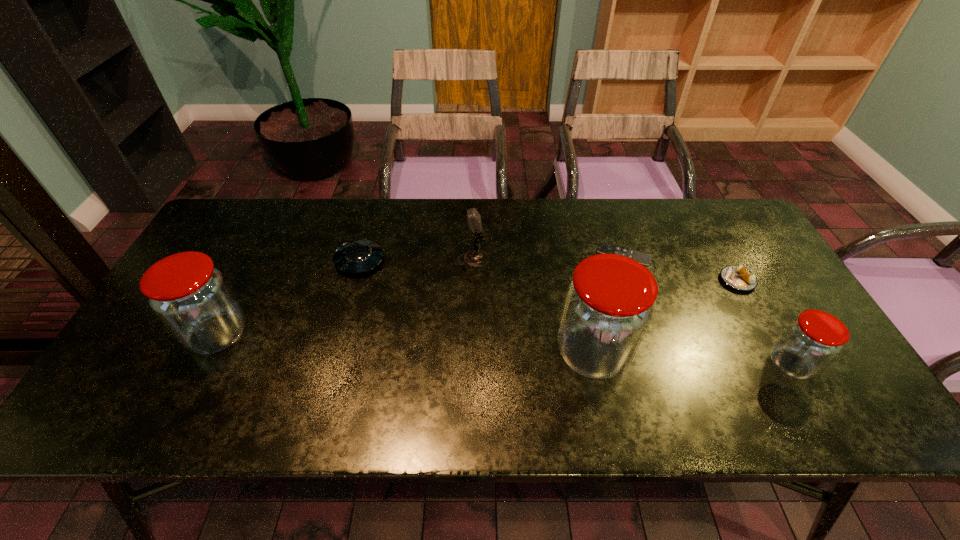
The height and width of the screenshot is (540, 960). Find the location of `free spot located on the left of the second tallest jar`. free spot located on the left of the second tallest jar is located at coordinates (144, 335).

What are the coordinates of `vacant space located 0.110m on the left of the second jar from left to right` in the screenshot? It's located at (510, 354).

Locate an element on the screen. Image resolution: width=960 pixels, height=540 pixels. vacant region located on the back of the rightmost jar is located at coordinates (739, 274).

Where is `free spot located 0.100m on the front-facing side of the microphone`? free spot located 0.100m on the front-facing side of the microphone is located at coordinates (523, 260).

Find the location of a particular element. free space located 0.260m on the right of the shortest object is located at coordinates (737, 254).

Locate an element on the screen. free space located on the left of the second object from left to right is located at coordinates click(311, 261).

Where is `free space located on the front of the pastry`? This screenshot has width=960, height=540. free space located on the front of the pastry is located at coordinates (757, 316).

At what (x,y) coordinates should I click in order to perform the action: click on remote control positioned at the far edge. Please return your answer as a coordinate pair (x, y). Looking at the image, I should click on (643, 258).

Where is `saucer present at the far edge`? Image resolution: width=960 pixels, height=540 pixels. saucer present at the far edge is located at coordinates (357, 256).

Image resolution: width=960 pixels, height=540 pixels. I want to click on object at the left edge, so click(191, 297).